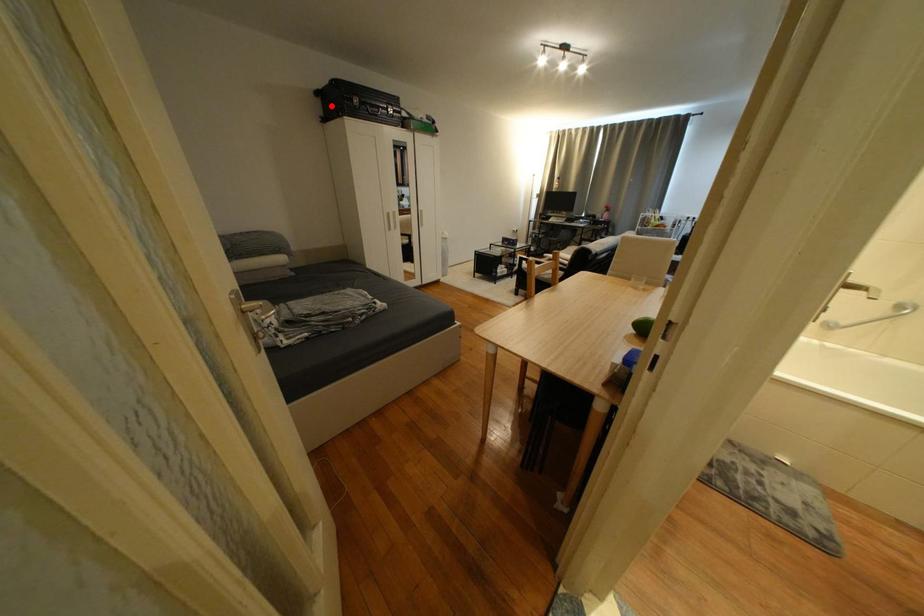
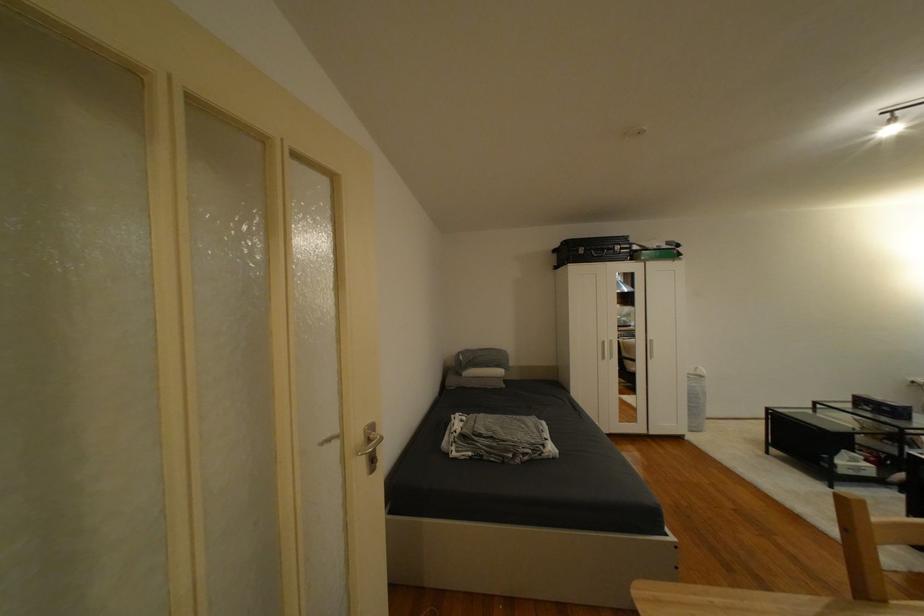
Where in the second image is the point corresponding to the highlighted location from the first image?

(565, 257)